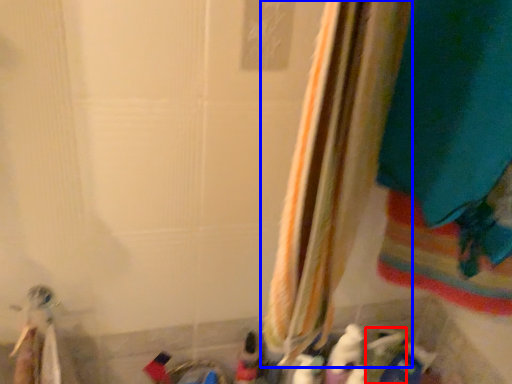
Question: Which point is closer to the camera, toy (highlighted by a red box) or curtain (highlighted by a blue box)?

Choices:
 (A) toy
 (B) curtain

Answer: (B)